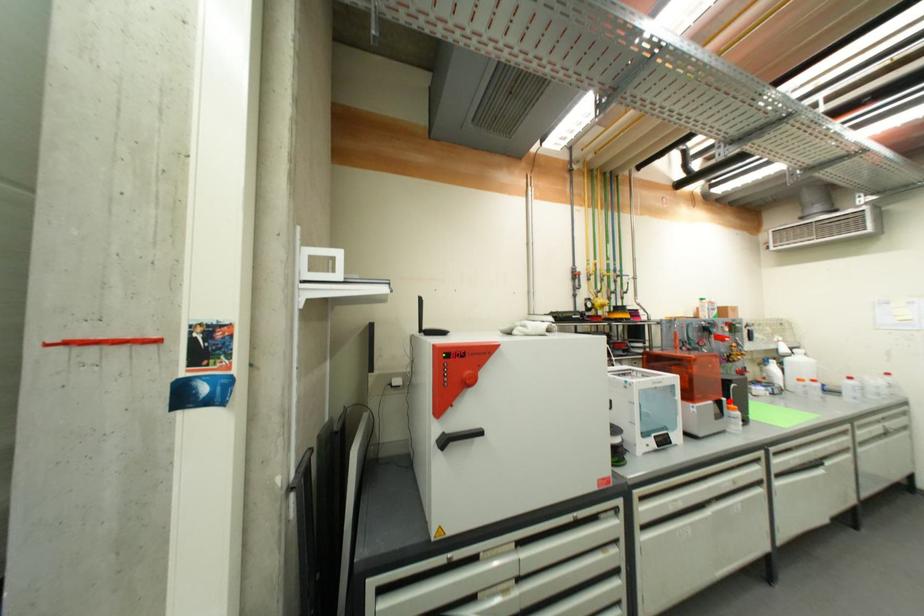
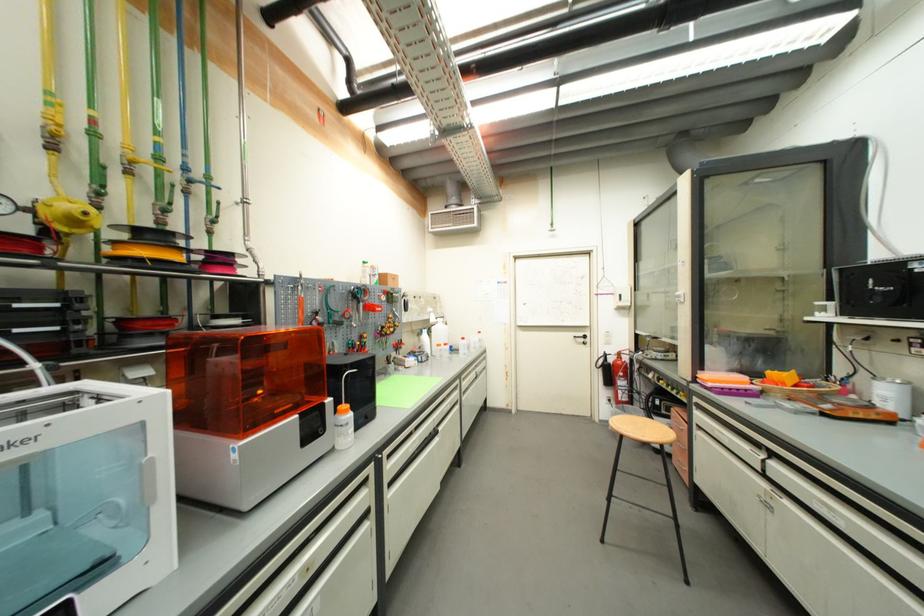
Find the pixel in the second image that matches the highlighted location in the first image.

(334, 402)